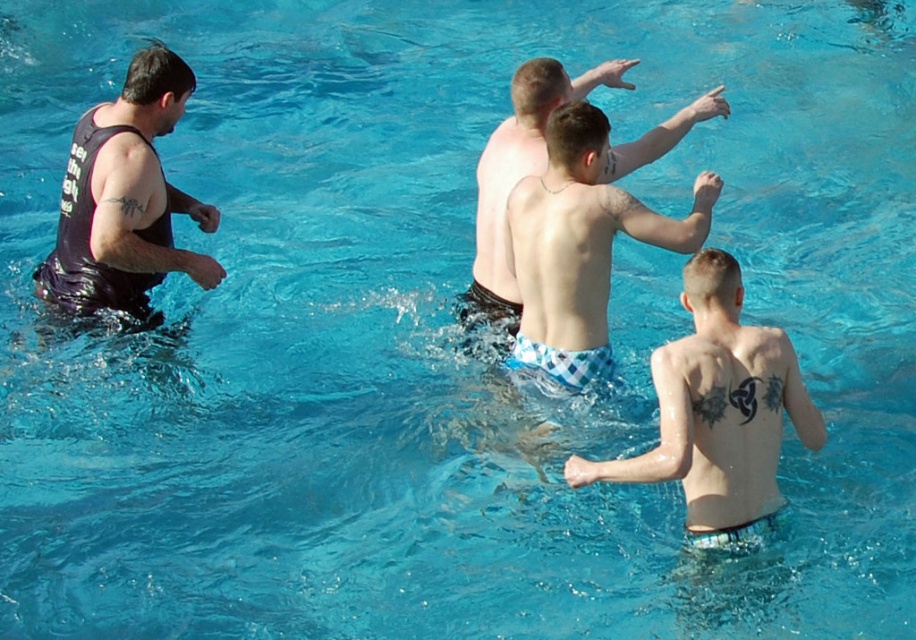
In the pool scene, there are two men wearing checkered shorts. One has checkered fabric shorts at center and the other has light blue checkered shorts at center. Which one is positioned to the right of the other?

The checkered fabric shorts at center are positioned to the right of the light blue checkered shorts at center.